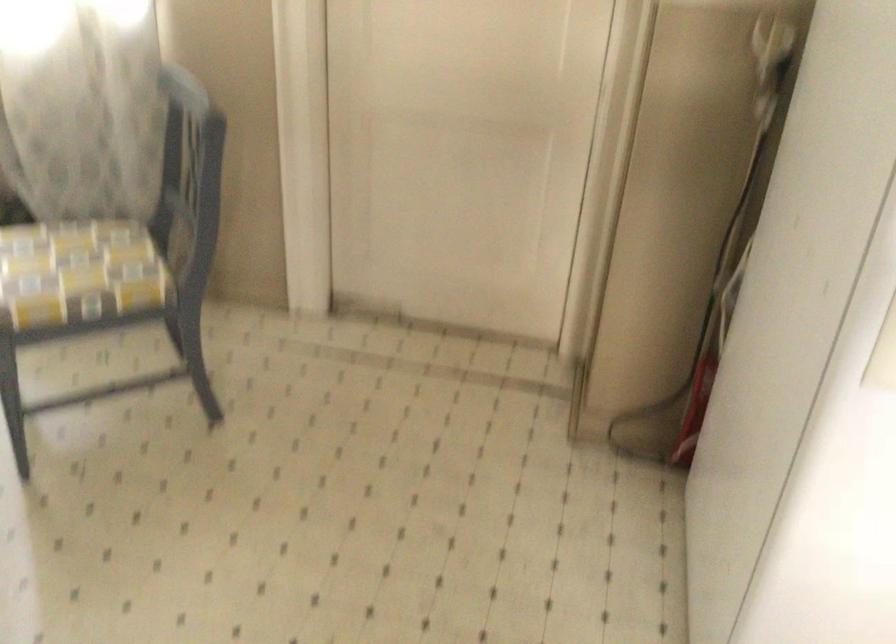
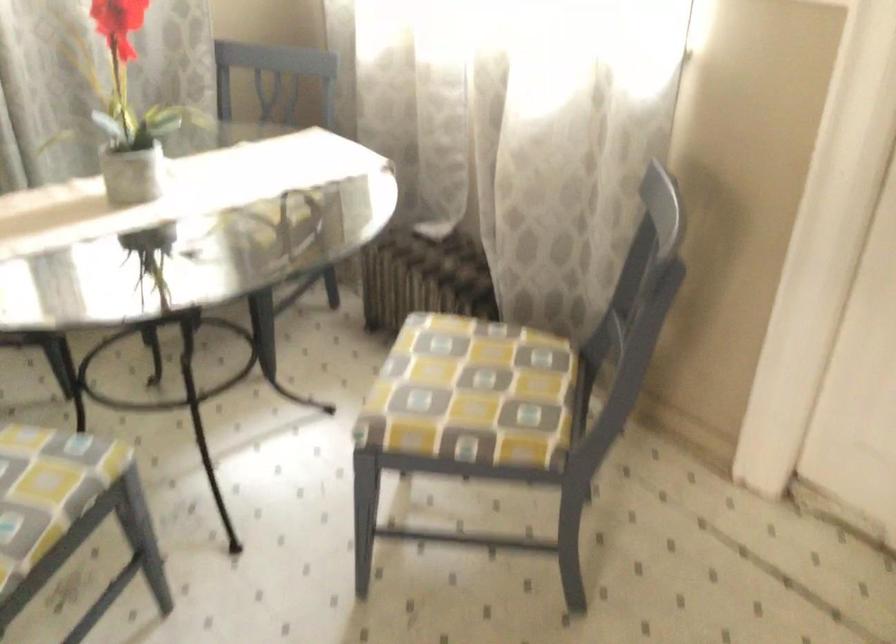
Question: The camera is either moving clockwise (left) or counter-clockwise (right) around the object. The first image is from the beginning of the video and the second image is from the end. Is the camera moving left or right when shooting the video?

Choices:
 (A) Left
 (B) Right

Answer: (B)